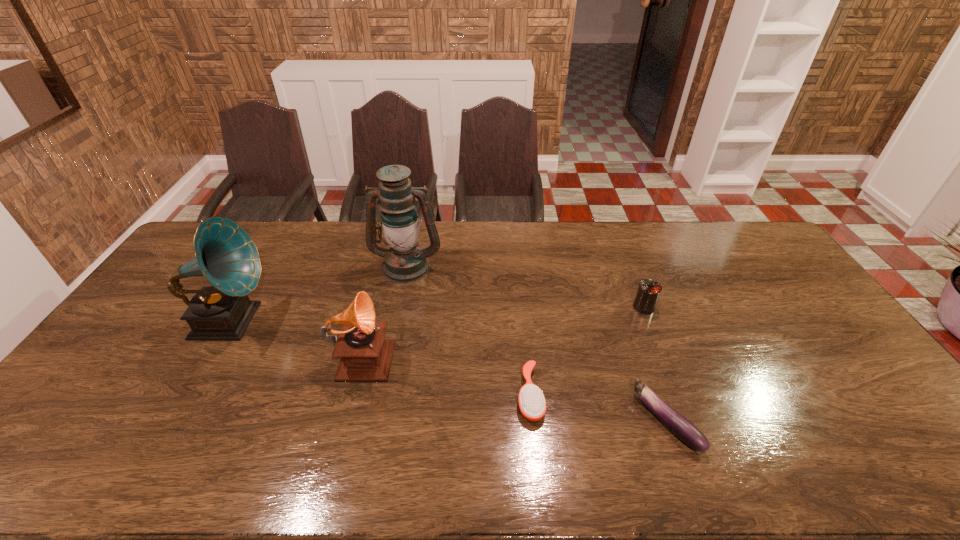
Where is `free space at the far right corner of the desktop`? The height and width of the screenshot is (540, 960). free space at the far right corner of the desktop is located at coordinates (722, 235).

You are a GUI agent. You are given a task and a screenshot of the screen. Output one action in this format:
    pyautogui.click(x=<x>, y=<y>)
    Task: Click on the free space between the third tallest object and the hairbrush
    
    Given the screenshot: What is the action you would take?
    pyautogui.click(x=446, y=374)

Find the location of `free area in between the shorter phonograph record and the left phonograph record`. free area in between the shorter phonograph record and the left phonograph record is located at coordinates (297, 337).

Where is `vacant space in between the eggplant and the can`? Image resolution: width=960 pixels, height=540 pixels. vacant space in between the eggplant and the can is located at coordinates (655, 364).

The image size is (960, 540). I want to click on empty location between the fourth shortest object and the leftmost object, so click(x=297, y=337).

Identify the location of free space between the shorter phonograph record and the farthest object. (385, 309).

You are a GUI agent. You are given a task and a screenshot of the screen. Output one action in this format:
    pyautogui.click(x=<x>, y=<y>)
    Task: Click on the vacant area that lies between the eggplant and the leftmost object
    This screenshot has width=960, height=540.
    Given the screenshot: What is the action you would take?
    pyautogui.click(x=448, y=370)

Image resolution: width=960 pixels, height=540 pixels. Find the location of `empty space between the eggplant and the third shortest object`. empty space between the eggplant and the third shortest object is located at coordinates (655, 364).

Locate an element on the screen. Image resolution: width=960 pixels, height=540 pixels. vacant space in between the fourth tallest object and the left phonograph record is located at coordinates point(437,314).

Where is `empty space between the third shortest object and the fourth shortest object`? This screenshot has height=540, width=960. empty space between the third shortest object and the fourth shortest object is located at coordinates (504, 330).